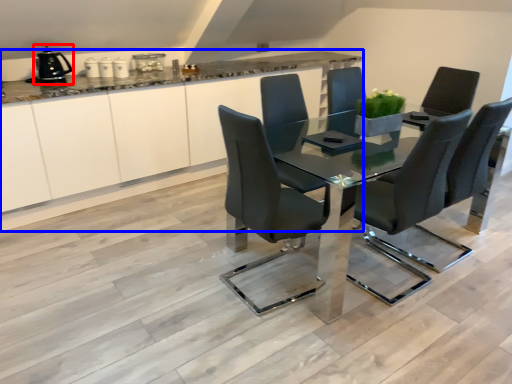
Question: Among these objects, which one is farthest to the camera, appliance (highlighted by a red box) or cabinetry (highlighted by a blue box)?

Choices:
 (A) appliance
 (B) cabinetry

Answer: (A)